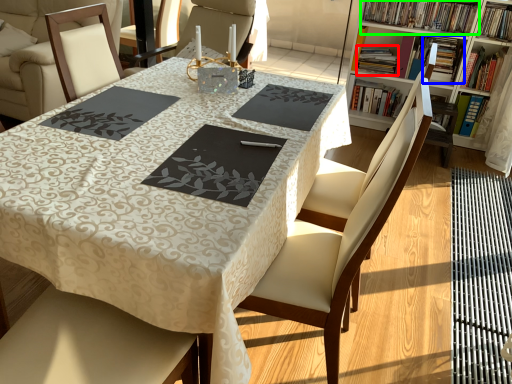
Question: Which object is positioned closest to book (highlighted by a red box)? Select from book (highlighted by a blue box) and book (highlighted by a green box).

Choices:
 (A) book
 (B) book

Answer: (A)